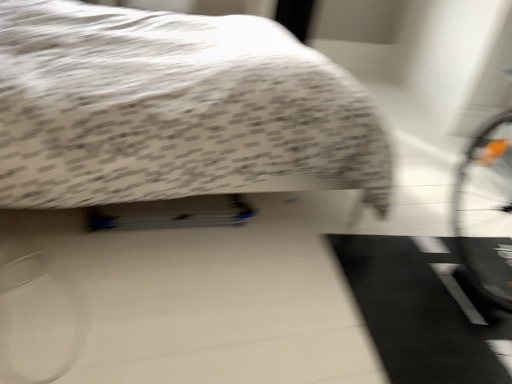
Locate an element on the screen. The image size is (512, 384). black rubber doormat at lower right is located at coordinates (417, 313).

Image resolution: width=512 pixels, height=384 pixels. Describe the element at coordinates (417, 313) in the screenshot. I see `black rubber doormat at lower right` at that location.

Describe the element at coordinates (172, 108) in the screenshot. I see `white textured bed at upper center` at that location.

Find the location of a particular element. This screenshot has height=384, width=512. white textured bed at upper center is located at coordinates (172, 108).

Find the location of a particular element. black rubber doormat at lower right is located at coordinates (417, 313).

Can you confirm if black rubber doormat at lower right is positioned to the left of white textured bed at upper center?

Incorrect, black rubber doormat at lower right is not on the left side of white textured bed at upper center.

Between black rubber doormat at lower right and white textured bed at upper center, which one is positioned in front?

white textured bed at upper center.

Which is further, (362, 304) or (3, 9)?

The point (3, 9) is more distant.

From the image's perspective, who appears lower, black rubber doormat at lower right or white textured bed at upper center?

From the image's view, black rubber doormat at lower right is below.

From a real-world perspective, which is physically below, black rubber doormat at lower right or white textured bed at upper center?

black rubber doormat at lower right.

Which of these two, black rubber doormat at lower right or white textured bed at upper center, is thinner?

With smaller width is black rubber doormat at lower right.

Which of these two, black rubber doormat at lower right or white textured bed at upper center, stands shorter?

black rubber doormat at lower right is shorter.

Is black rubber doormat at lower right bigger or smaller than white textured bed at upper center?

In the image, black rubber doormat at lower right appears to be smaller than white textured bed at upper center.

Is black rubber doormat at lower right surrounding white textured bed at upper center?

No, black rubber doormat at lower right does not contain white textured bed at upper center.

Looking at this image, is black rubber doormat at lower right in contact with white textured bed at upper center?

They are not placed beside each other.

Could you tell me if black rubber doormat at lower right is facing white textured bed at upper center?

No, black rubber doormat at lower right is not aimed at white textured bed at upper center.

What's the angular difference between black rubber doormat at lower right and white textured bed at upper center's facing directions?

They differ by 82.2 degrees in their facing directions.

Measure the distance from black rubber doormat at lower right to white textured bed at upper center.

The distance of black rubber doormat at lower right from white textured bed at upper center is 80.56 centimeters.

Image resolution: width=512 pixels, height=384 pixels. I want to click on bed in front of the black rubber doormat at lower right, so click(172, 108).

Considering the positions of objects white textured bed at upper center and black rubber doormat at lower right in the image provided, who is more to the right, white textured bed at upper center or black rubber doormat at lower right?

black rubber doormat at lower right is more to the right.

Is white textured bed at upper center further to camera compared to black rubber doormat at lower right?

No.

Is point (117, 23) in front of point (423, 276)?

No, (117, 23) is behind (423, 276).

From the image's perspective, which is above, white textured bed at upper center or black rubber doormat at lower right?

white textured bed at upper center appears higher in the image.

From a real-world perspective, is white textured bed at upper center beneath black rubber doormat at lower right?

No, from a real-world perspective, white textured bed at upper center is not under black rubber doormat at lower right.

From the picture: Can you confirm if white textured bed at upper center is wider than black rubber doormat at lower right?

Yes.

Does white textured bed at upper center have a greater height compared to black rubber doormat at lower right?

Indeed, white textured bed at upper center has a greater height compared to black rubber doormat at lower right.

Based on their sizes in the image, would you say white textured bed at upper center is bigger or smaller than black rubber doormat at lower right?

In the image, white textured bed at upper center appears to be larger than black rubber doormat at lower right.

Is white textured bed at upper center outside of black rubber doormat at lower right?

Yes, white textured bed at upper center is located beyond the bounds of black rubber doormat at lower right.

Is white textured bed at upper center positioned far away from black rubber doormat at lower right?

No.

Is white textured bed at upper center facing towards black rubber doormat at lower right?

No.

Can you tell me how much white textured bed at upper center and black rubber doormat at lower right differ in facing direction?

82.2 degrees.

Find the location of a particular element. This screenshot has width=512, height=384. doormat located behind the white textured bed at upper center is located at coordinates (417, 313).

This screenshot has width=512, height=384. Identify the location of doormat below the white textured bed at upper center (from a real-world perspective). (417, 313).

What are the coordinates of `doormat on the right of white textured bed at upper center` in the screenshot? It's located at (417, 313).